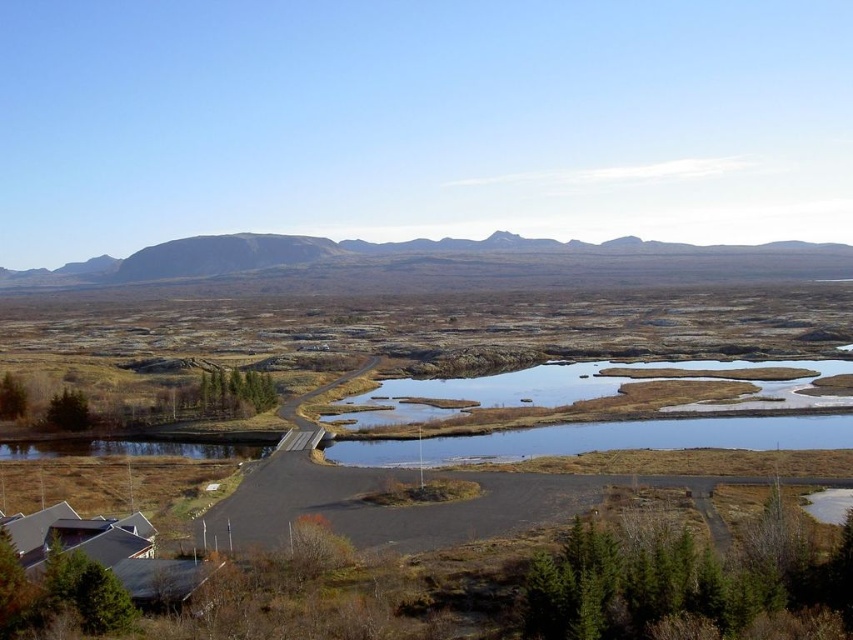
You are standing at the bottom left of the image, where the road begins. You want to walk directly to the brown grassy lake at center. How far will you have to walk?

The brown grassy lake at center and the viewer are 171.97 meters apart from each other, so you will have to walk approximately 171.97 meters to reach it.

You are a hiker planning to cross the brown grassy lake at center to reach the gray rocky mountain at center. The lake is frozen, but you have a map showing the distance between them. Based on the distance provided, can you safely walk across the lake to the mountain without the ice breaking?

The brown grassy lake at center is 322.11 meters from the gray rocky mountain at center. However, ice safety depends on thickness and conditions not provided here. The distance alone cannot confirm if the ice is safe to walk on.

You are a hiker planning to cross the brown grassy lake at center and reach the gray rocky mountain at center. Based on the scene, can you determine which direction you should head to first?

The brown grassy lake at center is in front of the gray rocky mountain at center, so to reach the mountain, you should head towards the direction of the lake first.